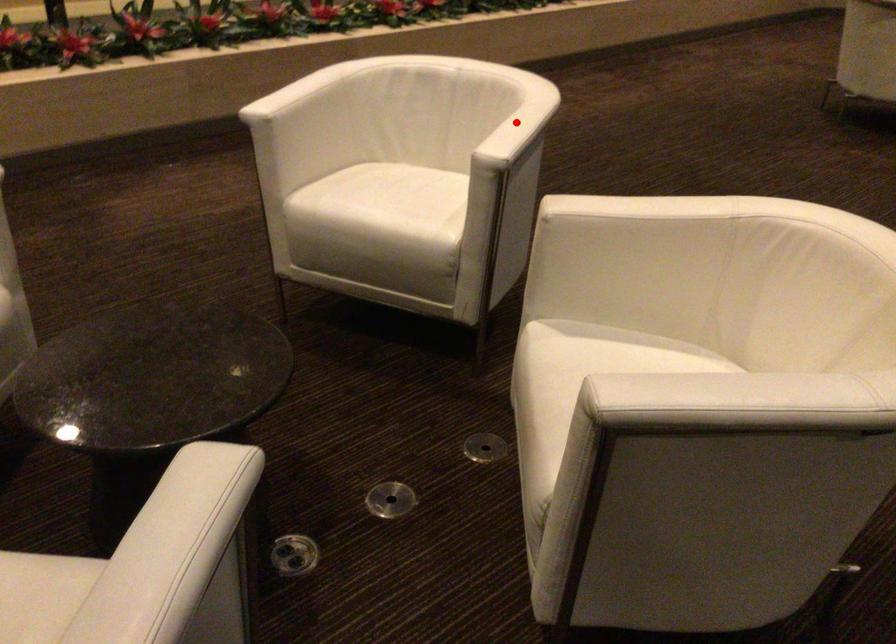
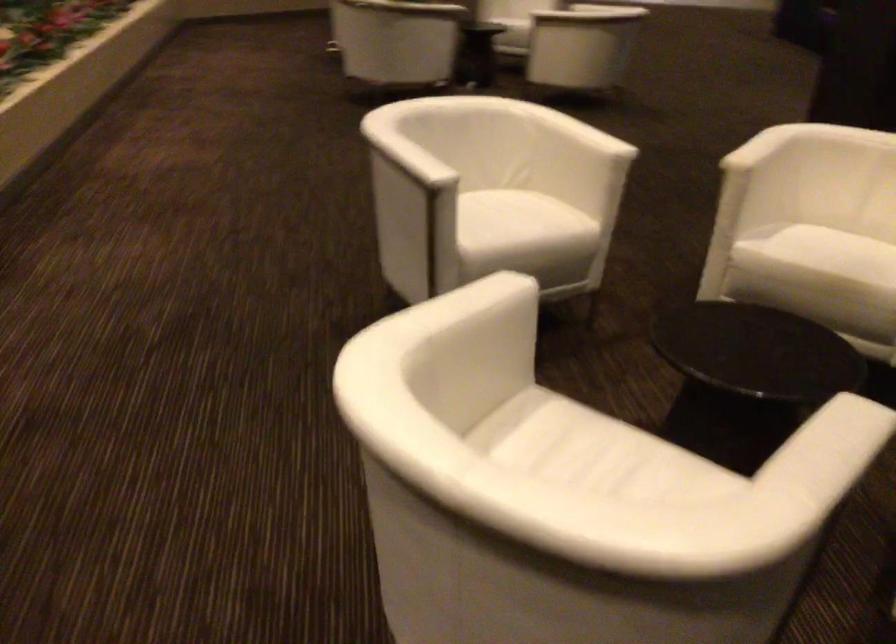
Question: I am providing you with two images of the same scene from different viewpoints. A red point is marked on the first image. Is the red point's position out of view in image 2?

Choices:
 (A) Yes
 (B) No

Answer: (A)